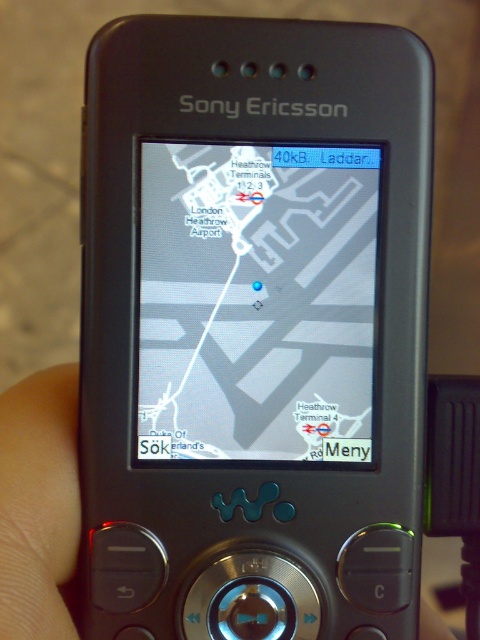
You are holding the black matte sony ericsson phone at center and want to check the map displayed on the matte gray map at center. Which direction should you tilt the phone to view the map properly?

The black matte sony ericsson phone at center is below the matte gray map at center, so you should tilt the phone upward to view the map properly.